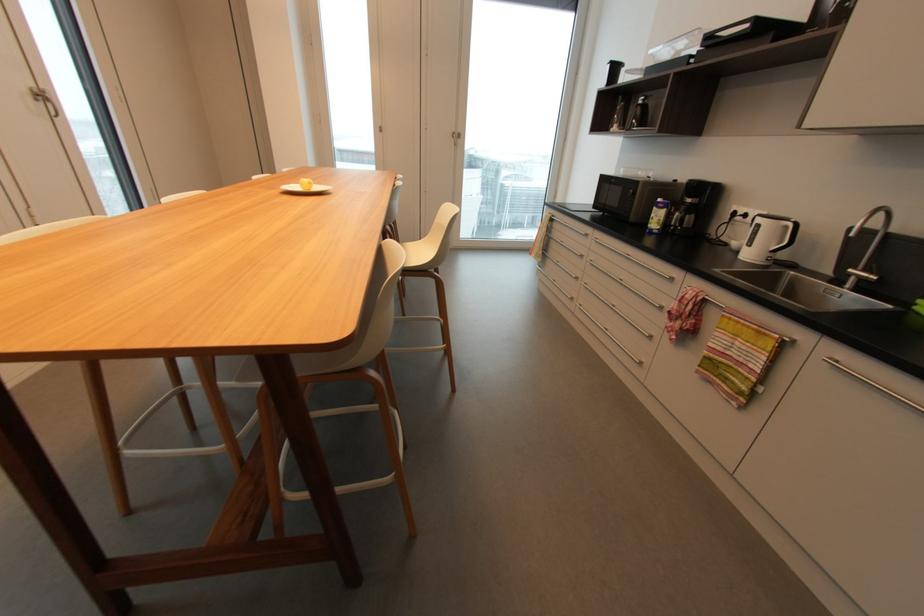
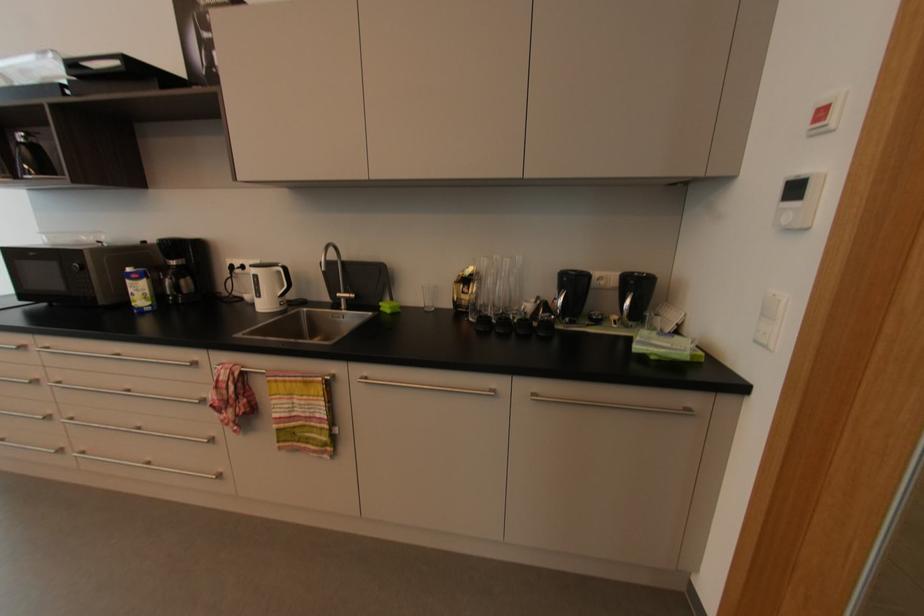
Question: I am providing you with two images of the same scene from different viewpoints. Which of the following objects are not visible in image2?

Choices:
 (A) tall glass flute
 (B) towel rack handle
 (C) green wipes container
 (D) none of these

Answer: (D)